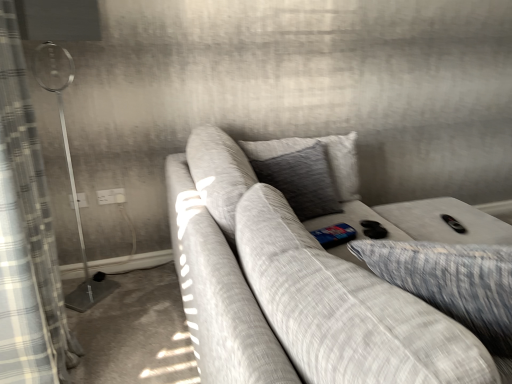
Question: In the image, is gray textured pillow at center, arranged as the 1th pillow when viewed from the left, positioned in front of or behind plaid fabric curtain at left?

Choices:
 (A) behind
 (B) front

Answer: (A)

Question: In terms of width, does gray textured pillow at center, arranged as the 1th pillow when viewed from the left, look wider or thinner when compared to plaid fabric curtain at left?

Choices:
 (A) thin
 (B) wide

Answer: (A)

Question: Estimate the real-world distances between objects in this image. Which object is closer to the textured gray couch at center?

Choices:
 (A) white plastic electric outlet at lower left, the 2th electric outlet when ordered from right to left
 (B) white plastic electric outlet at upper left, placed as the 1th electric outlet when sorted from right to left
 (C) plaid fabric curtain at left
 (D) textured gray pillow at right, arranged as the 1th pillow when viewed from the right
 (E) gray textured pillow at center, arranged as the 1th pillow when viewed from the left

Answer: (E)

Question: Which of these objects is positioned farthest from the white plastic electric outlet at lower left, the first electric outlet in the left-to-right sequence?

Choices:
 (A) white plastic electric outlet at upper left, marked as the 2th electric outlet in a left-to-right arrangement
 (B) plaid fabric curtain at left
 (C) gray textured pillow at center, which is the second pillow in right-to-left order
 (D) textured gray pillow at right, the 2th pillow positioned from the left
 (E) textured gray couch at center

Answer: (D)